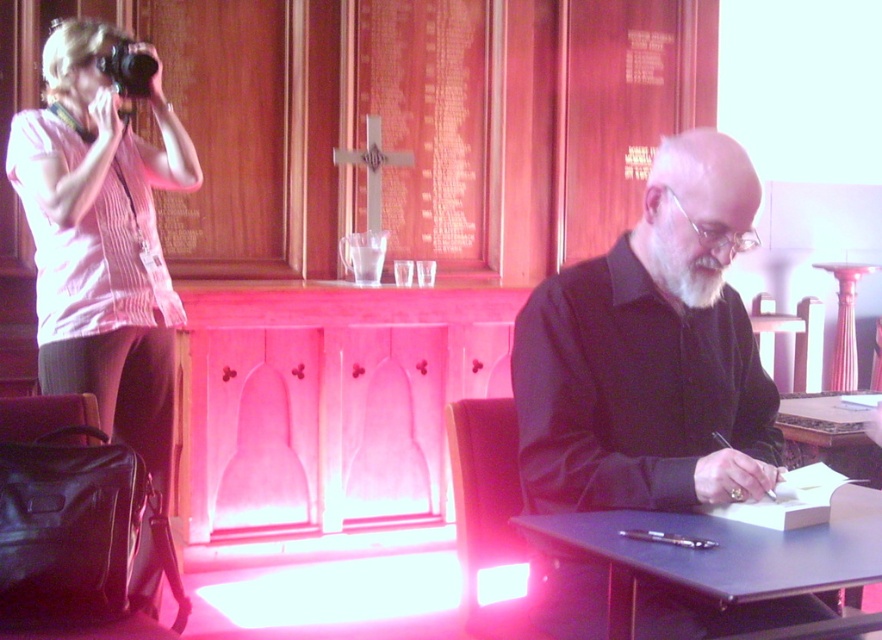
Question: Which point is farther from the camera taking this photo?

Choices:
 (A) click(x=28, y=144)
 (B) click(x=757, y=416)

Answer: (A)

Question: Which point is farther to the camera?

Choices:
 (A) (117, 68)
 (B) (124, 38)
 (C) (664, 630)
 (D) (738, 561)

Answer: (B)

Question: Considering the real-world distances, which object is farthest from the black plastic camera at upper left?

Choices:
 (A) black plastic table at lower right
 (B) black matte shirt at center
 (C) pink striped shirt at left

Answer: (A)

Question: From the image, what is the correct spatial relationship of pink striped shirt at left in relation to black plastic table at lower right?

Choices:
 (A) above
 (B) below

Answer: (A)

Question: Is pink striped shirt at left positioned at the back of black plastic table at lower right?

Choices:
 (A) yes
 (B) no

Answer: (A)

Question: Considering the relative positions of black matte shirt at center and black plastic table at lower right in the image provided, where is black matte shirt at center located with respect to black plastic table at lower right?

Choices:
 (A) above
 (B) below

Answer: (A)